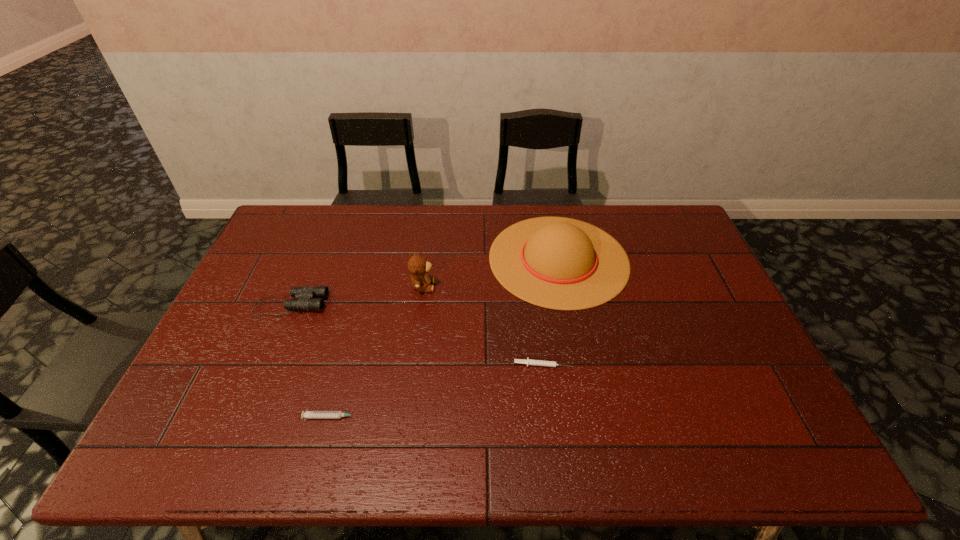
Identify which object is located as the fourth nearest to the sombrero. Please provide its 2D coordinates. Your answer should be formatted as a tuple, i.e. [(x, y)], where the tuple contains the x and y coordinates of a point satisfying the conditions above.

[(304, 299)]

Locate which object is the second closest to the binoculars. Please provide its 2D coordinates. Your answer should be formatted as a tuple, i.e. [(x, y)], where the tuple contains the x and y coordinates of a point satisfying the conditions above.

[(306, 414)]

Locate an element on the screen. The image size is (960, 540). vacant region that satisfies the following two spatial constraints: 1. on the face of the teddy bear; 2. on the right side of the shorter syringe is located at coordinates (413, 364).

Identify the location of vacant area that satisfies the following two spatial constraints: 1. on the face of the teddy bear; 2. on the back side of the shorter syringe. (413, 364).